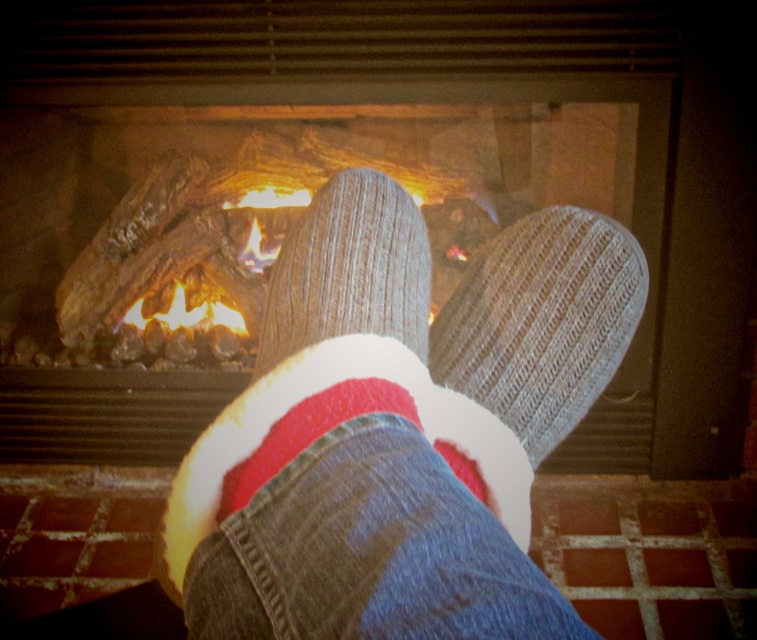
Question: Does gray knitted sock at center appear on the right side of knit socks at center?

Choices:
 (A) yes
 (B) no

Answer: (A)

Question: Which point is closer to the camera taking this photo?

Choices:
 (A) (265, 529)
 (B) (103, 77)
 (C) (298, 332)
 (D) (522, 548)

Answer: (A)

Question: In this image, where is knit socks at center located relative to white fleece sock at center?

Choices:
 (A) left
 (B) right

Answer: (A)

Question: Considering the real-world distances, which object is farthest from the gray knitted sock at center?

Choices:
 (A) knit socks at center
 (B) knitted socks at center
 (C) white fleece sock at center
 (D) wooden logs at center

Answer: (D)

Question: Which point appears closest to the camera in this image?

Choices:
 (A) (592, 394)
 (B) (447, 138)
 (C) (497, 387)
 (D) (371, 180)

Answer: (C)

Question: Is knit socks at center below white fleece sock at center?

Choices:
 (A) no
 (B) yes

Answer: (A)